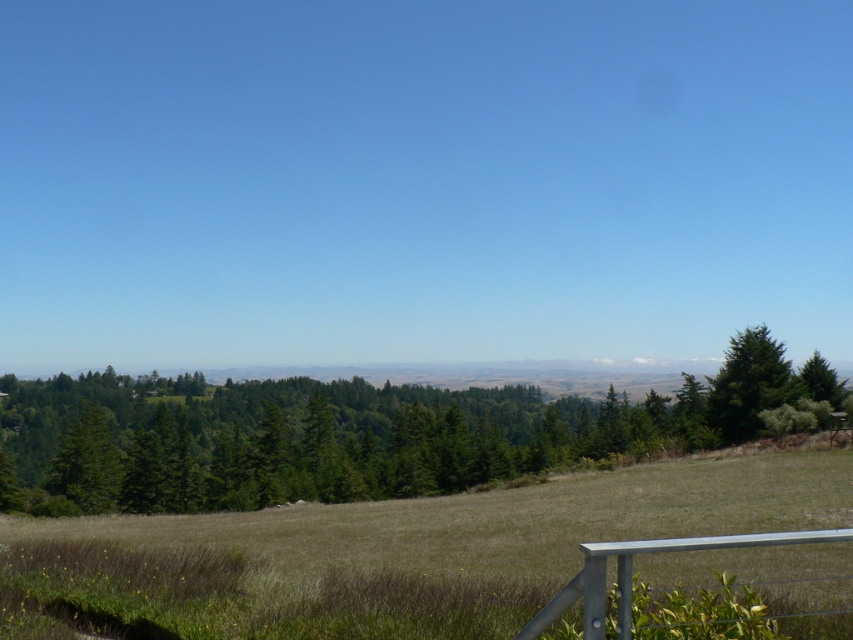
Question: Does brown dry grass at center have a lesser width compared to silver metallic rail at lower right?

Choices:
 (A) yes
 (B) no

Answer: (B)

Question: Which of the following is the closest to the observer?

Choices:
 (A) (746, 368)
 (B) (45, 621)

Answer: (B)

Question: Estimate the real-world distances between objects in this image. Which object is closer to the green textured tree at center?

Choices:
 (A) silver metallic rail at lower right
 (B) brown dry grass at center

Answer: (B)

Question: Is the position of brown dry grass at center more distant than that of silver metallic rail at lower right?

Choices:
 (A) no
 (B) yes

Answer: (B)

Question: Which point is closer to the camera?

Choices:
 (A) silver metallic rail at lower right
 (B) brown dry grass at center
 (C) green textured tree at right

Answer: (A)

Question: Considering the relative positions of brown dry grass at center and green textured tree at center in the image provided, where is brown dry grass at center located with respect to green textured tree at center?

Choices:
 (A) left
 (B) right

Answer: (B)